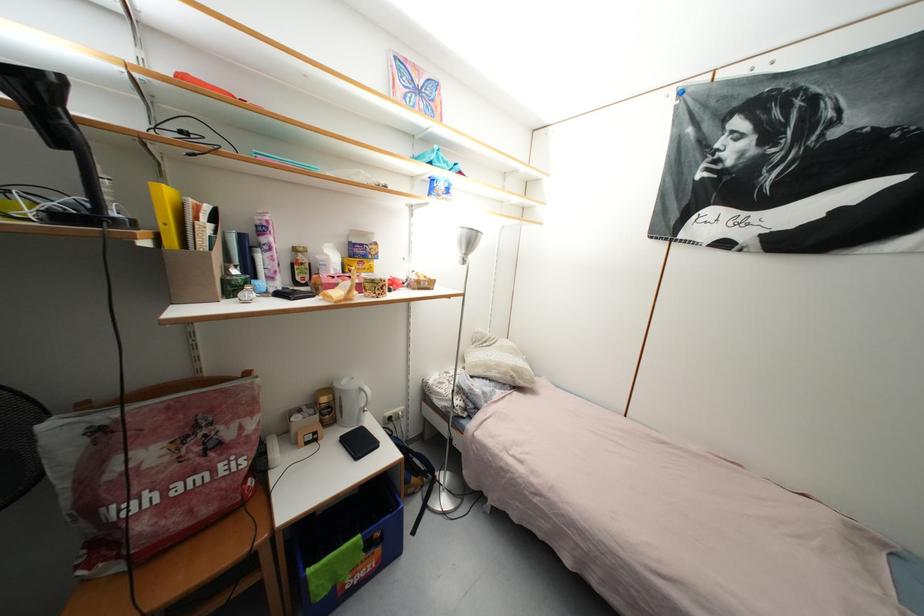
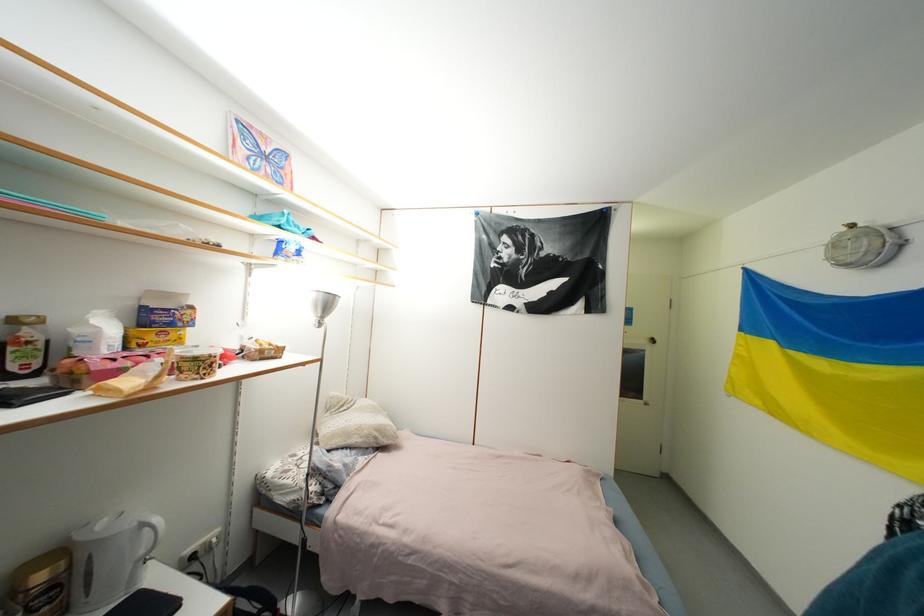
Find the pixel in the second image that matches [375,270] in the first image.

(185, 342)